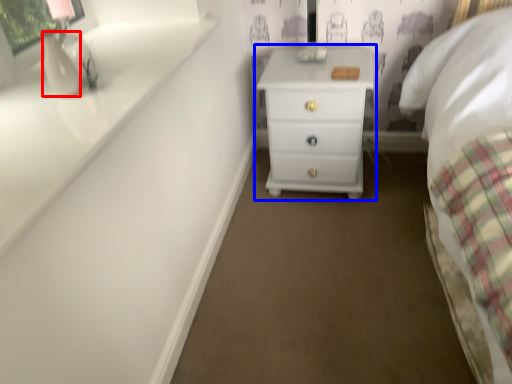
Question: Which object appears closest to the camera in this image, vase (highlighted by a red box) or chest of drawers (highlighted by a blue box)?

Choices:
 (A) vase
 (B) chest of drawers

Answer: (A)